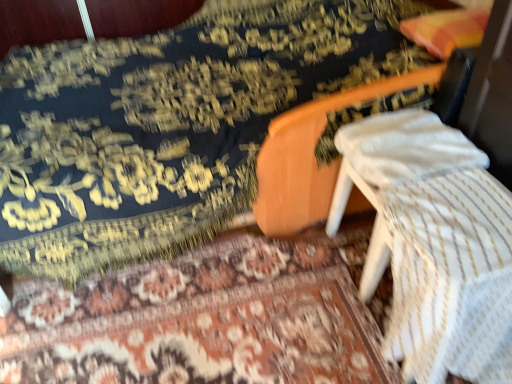
Question: Is white cotton pillow at center turned away from floral carpet at center?

Choices:
 (A) no
 (B) yes

Answer: (A)

Question: Can you confirm if white cotton pillow at center is taller than floral carpet at center?

Choices:
 (A) no
 (B) yes

Answer: (B)

Question: Is white cotton pillow at center far from floral carpet at center?

Choices:
 (A) no
 (B) yes

Answer: (A)

Question: Is white cotton pillow at center to the right of floral carpet at center from the viewer's perspective?

Choices:
 (A) no
 (B) yes

Answer: (B)

Question: Is the depth of white cotton pillow at center greater than that of floral carpet at center?

Choices:
 (A) yes
 (B) no

Answer: (A)

Question: Considering the positions of point (309, 23) and point (368, 130), is point (309, 23) closer or farther from the camera than point (368, 130)?

Choices:
 (A) farther
 (B) closer

Answer: (A)

Question: In terms of width, does velvet-like dark blue mattress at center look wider or thinner when compared to white cotton pillow at center?

Choices:
 (A) thin
 (B) wide

Answer: (B)

Question: From a real-world perspective, is velvet-like dark blue mattress at center above or below white cotton pillow at center?

Choices:
 (A) above
 (B) below

Answer: (B)

Question: In terms of size, does velvet-like dark blue mattress at center appear bigger or smaller than white cotton pillow at center?

Choices:
 (A) small
 (B) big

Answer: (B)

Question: Choose the correct answer: Is white cotton pillow at center inside floral carpet at center or outside it?

Choices:
 (A) outside
 (B) inside

Answer: (A)

Question: Looking at their shapes, would you say white cotton pillow at center is wider or thinner than floral carpet at center?

Choices:
 (A) wide
 (B) thin

Answer: (B)

Question: From a real-world perspective, is white cotton pillow at center positioned above or below floral carpet at center?

Choices:
 (A) below
 (B) above

Answer: (B)

Question: Considering the positions of point (465, 160) and point (119, 337), is point (465, 160) closer or farther from the camera than point (119, 337)?

Choices:
 (A) closer
 (B) farther

Answer: (A)

Question: Which is correct: velvet-like dark blue mattress at center is inside floral carpet at center, or outside of it?

Choices:
 (A) inside
 (B) outside

Answer: (B)

Question: From a real-world perspective, is velvet-like dark blue mattress at center physically located above or below floral carpet at center?

Choices:
 (A) above
 (B) below

Answer: (A)